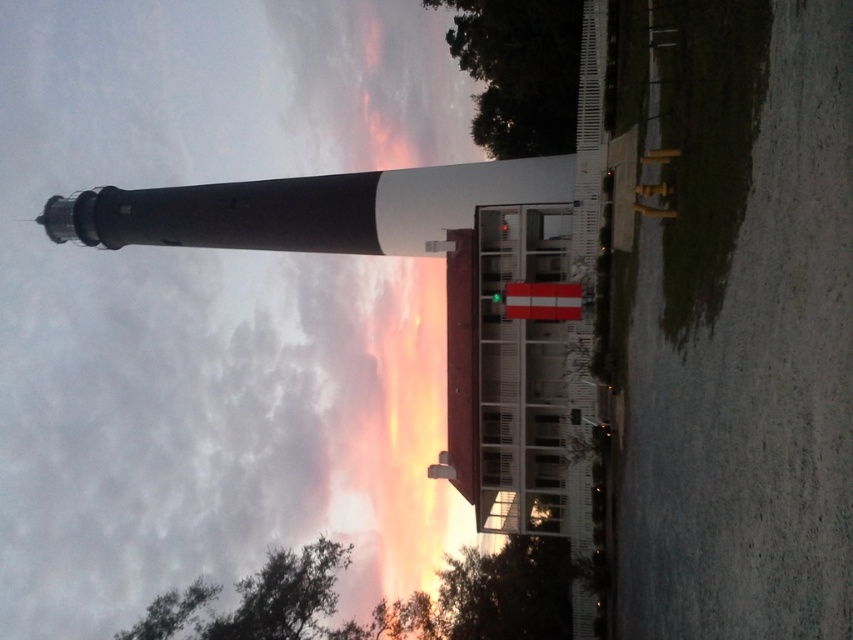
Can you confirm if cloudy sky at upper center is positioned to the right of smooth black lighthouse at left?

No, cloudy sky at upper center is not to the right of smooth black lighthouse at left.

Does cloudy sky at upper center appear over smooth black lighthouse at left?

No, cloudy sky at upper center is not above smooth black lighthouse at left.

Does point (439, 380) lie behind point (415, 214)?

Yes, it is behind point (415, 214).

This screenshot has height=640, width=853. In order to click on cloudy sky at upper center in this screenshot , I will do `click(213, 308)`.